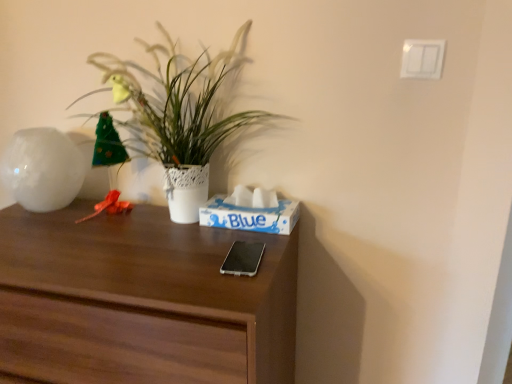
In order to click on free point behind silver metallic phone at center in this screenshot , I will do `click(230, 236)`.